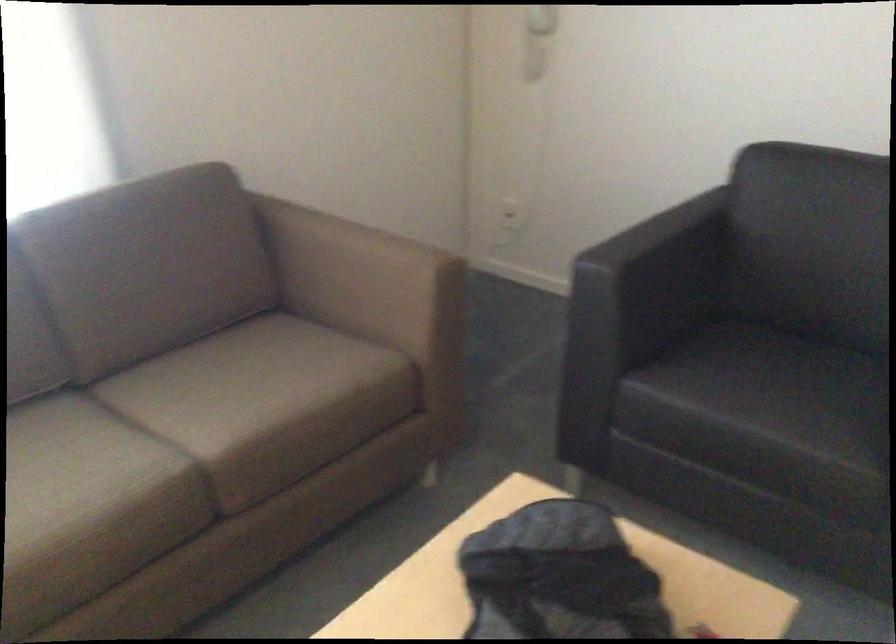
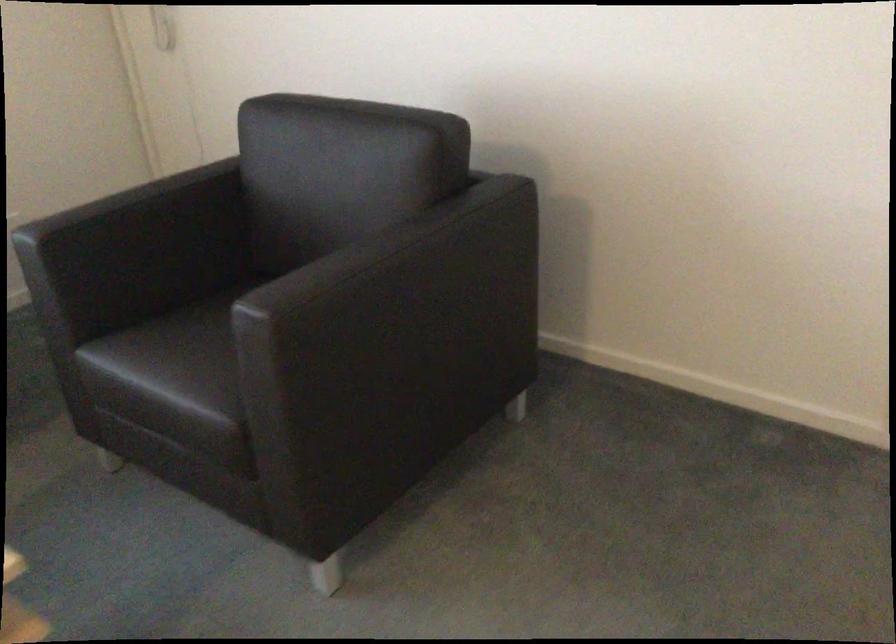
Question: I am providing you with two images of the same scene from different viewpoints. Which of the following objects are not visible in image2?

Choices:
 (A) black chair armrest
 (B) black chair sitting surface
 (C) electrical outlet
 (D) dispenser switch

Answer: (C)